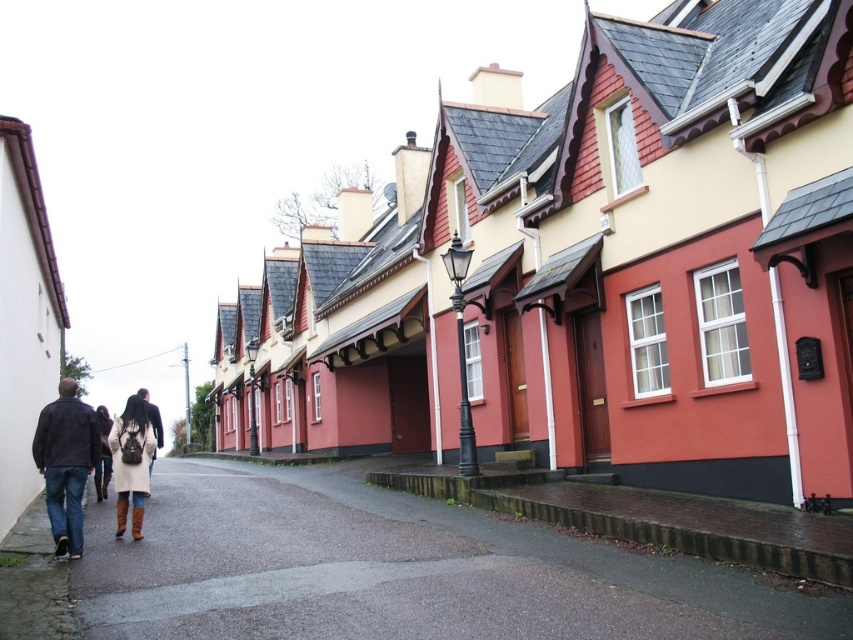
You are a delivery person trying to park your motorcycle between the gray asphalt pavement at lower left and the dark brown leather jacket at lower left. Can you fit your motorcycle there if it requires 1.2 meters of space?

The gray asphalt pavement at lower left is wider than the dark brown leather jacket at lower left. However, the exact width isn

You are a pedestrian walking on the gray asphalt pavement at lower left and see the dark brown leather jacket at lower left. Which one is closer to the ground?

The gray asphalt pavement at lower left is positioned under dark brown leather jacket at lower left, so the gray asphalt pavement at lower left is closer to the ground.